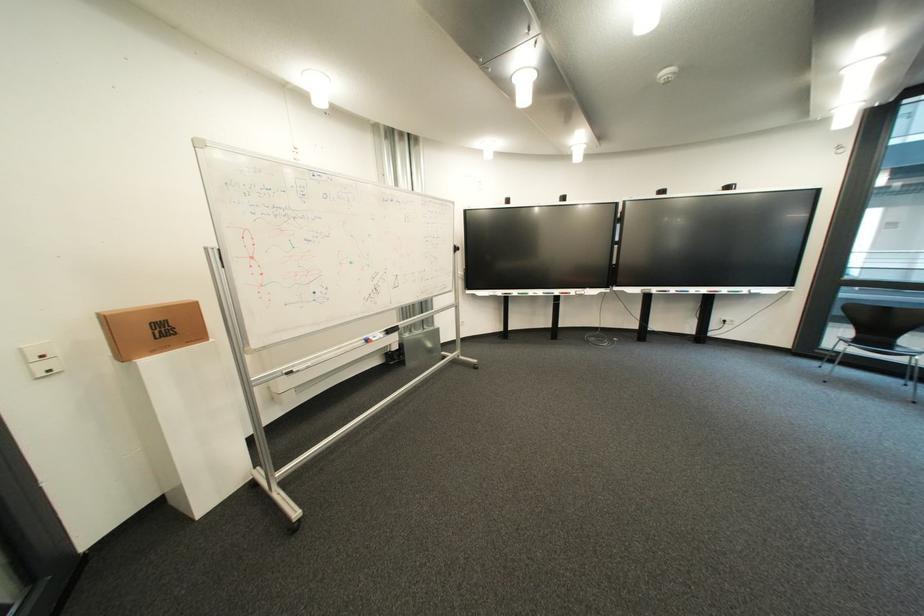
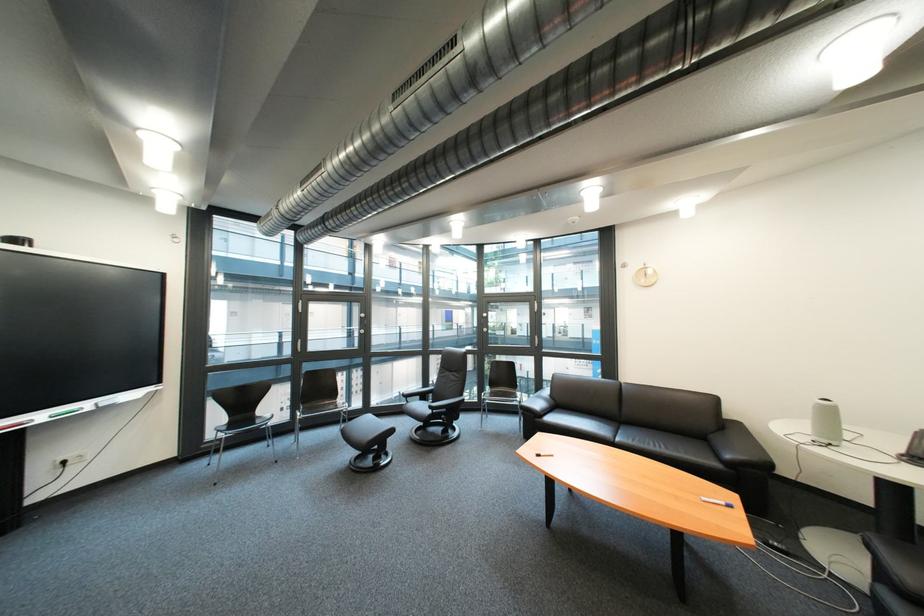
Find the pixel in the second image that matches [758,292] in the first image.

(101, 406)